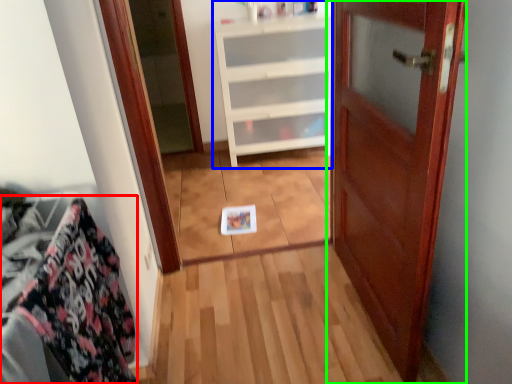
Question: Which is nearer to the material (highlighted by a red box)? cabinetry (highlighted by a blue box) or door (highlighted by a green box).

Choices:
 (A) cabinetry
 (B) door

Answer: (B)